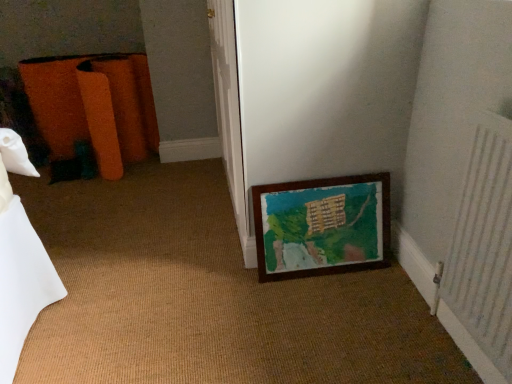
This screenshot has height=384, width=512. What do you see at coordinates (94, 107) in the screenshot? I see `orange fabric bag at left` at bounding box center [94, 107].

The image size is (512, 384). Identify the location of orange fabric bag at left. (94, 107).

Is wooden frame at lower right oriented away from white textured radiator at right?

No, wooden frame at lower right is not facing the opposite direction of white textured radiator at right.

Which object is closer to the camera taking this photo, wooden frame at lower right or white textured radiator at right?

white textured radiator at right is in front.

Can you tell me how much wooden frame at lower right and white textured radiator at right differ in facing direction?

90.4 degrees separate the facing orientations of wooden frame at lower right and white textured radiator at right.

Can white textured radiator at right be found inside wooden frame at lower right?

No, white textured radiator at right is not inside wooden frame at lower right.

From a real-world perspective, is white textured radiator at right beneath wooden frame at lower right?

No, from a real-world perspective, white textured radiator at right is not beneath wooden frame at lower right.

Based on the photo, from the image's perspective, is white textured radiator at right located above wooden frame at lower right?

Actually, white textured radiator at right appears below wooden frame at lower right in the image.

Considering the points (498, 229) and (355, 240), which point is behind, point (498, 229) or point (355, 240)?

The point (355, 240) is farther from the camera.

Considering the sizes of objects white textured radiator at right and wooden frame at lower right in the image provided, who is bigger, white textured radiator at right or wooden frame at lower right?

white textured radiator at right.

Looking at this image, which is farther, (x=357, y=252) or (x=122, y=85)?

The point (x=122, y=85) is farther.

Looking at this image, from the image's perspective, is wooden frame at lower right above orange fabric bag at left?

No, from the image's perspective, wooden frame at lower right is not over orange fabric bag at left.

In the scene shown: Is wooden frame at lower right positioned with its back to orange fabric bag at left?

That's not correct — wooden frame at lower right is not looking away from orange fabric bag at left.

From a real-world perspective, is white textured radiator at right positioned above or below orange fabric bag at left?

From a real-world perspective, white textured radiator at right is physically above orange fabric bag at left.

Locate an element on the screen. furniture on the left of the white textured radiator at right is located at coordinates pyautogui.click(x=94, y=107).

Looking at this image, can you confirm if white textured radiator at right is wider than orange fabric bag at left?

No.

Consider the image. Is the depth of white textured radiator at right greater than that of orange fabric bag at left?

No, it is in front of orange fabric bag at left.

Considering the sizes of objects orange fabric bag at left and wooden frame at lower right in the image provided, who is wider, orange fabric bag at left or wooden frame at lower right?

orange fabric bag at left.

Considering the sizes of objects orange fabric bag at left and wooden frame at lower right in the image provided, who is bigger, orange fabric bag at left or wooden frame at lower right?

With larger size is orange fabric bag at left.

Is orange fabric bag at left taller than wooden frame at lower right?

Correct, orange fabric bag at left is much taller as wooden frame at lower right.

Can you confirm if orange fabric bag at left is shorter than white textured radiator at right?

Yes, orange fabric bag at left is shorter than white textured radiator at right.

How much distance is there between orange fabric bag at left and white textured radiator at right?

6.74 feet.

Is point (144, 55) positioned behind point (446, 303)?

Yes, point (144, 55) is behind point (446, 303).

Does orange fabric bag at left lie in front of white textured radiator at right?

No, the depth of orange fabric bag at left is greater than that of white textured radiator at right.

Find the location of a particular element. This screenshot has height=384, width=512. picture frame behind the white textured radiator at right is located at coordinates (322, 226).

Where is `picture frame on the left of white textured radiator at right`? picture frame on the left of white textured radiator at right is located at coordinates (322, 226).

Based on their spatial positions, is wooden frame at lower right or orange fabric bag at left closer to white textured radiator at right?

The object closer to white textured radiator at right is wooden frame at lower right.

From the image, which object appears to be nearer to orange fabric bag at left, white textured radiator at right or wooden frame at lower right?

The object closer to orange fabric bag at left is wooden frame at lower right.

Estimate the real-world distances between objects in this image. Which object is further from wooden frame at lower right, orange fabric bag at left or white textured radiator at right?

orange fabric bag at left is further to wooden frame at lower right.

Considering their positions, is orange fabric bag at left positioned further to white textured radiator at right than wooden frame at lower right?

Among the two, orange fabric bag at left is located further to white textured radiator at right.

Looking at the image, which one is located further to wooden frame at lower right, white textured radiator at right or orange fabric bag at left?

orange fabric bag at left lies further to wooden frame at lower right than the other object.

Based on their spatial positions, is wooden frame at lower right or white textured radiator at right closer to orange fabric bag at left?

Among the two, wooden frame at lower right is located nearer to orange fabric bag at left.

Where is `picture frame between orange fabric bag at left and white textured radiator at right in the horizontal direction`? picture frame between orange fabric bag at left and white textured radiator at right in the horizontal direction is located at coordinates (322, 226).